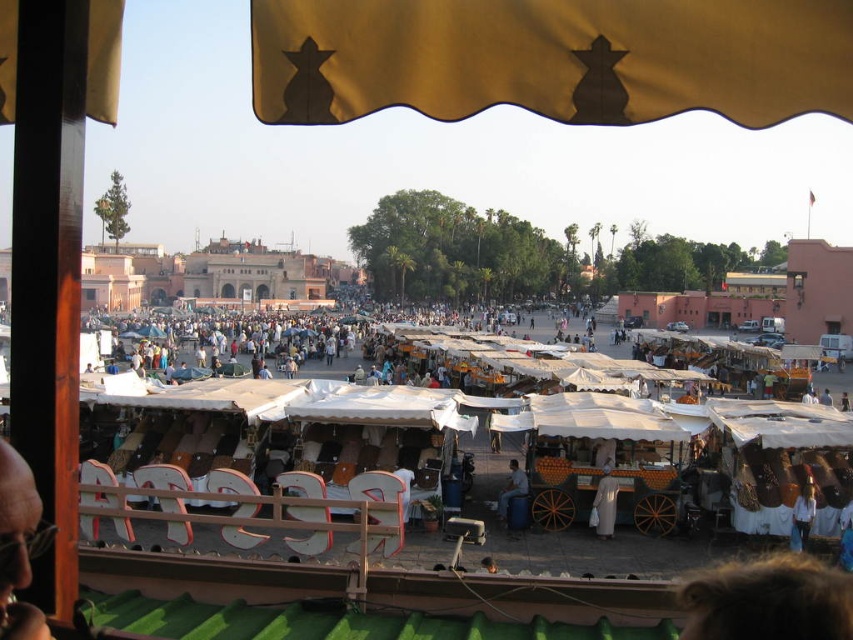
Between white cotton dress at center and light brown wooden cart at center, which one appears on the left side from the viewer's perspective?

light brown wooden cart at center is more to the left.

Between point (618, 490) and point (515, 465), which one is positioned in front?

Point (618, 490) is more forward.

Where is `white cotton dress at center`? white cotton dress at center is located at coordinates (604, 502).

Does point (798, 525) come in front of point (521, 493)?

Yes.

In the scene shown: Is white cotton dress at lower right smaller than light brown wooden cart at center?

Actually, white cotton dress at lower right might be larger than light brown wooden cart at center.

Who is more distant from viewer, (807,512) or (509,488)?

Positioned behind is point (509,488).

The image size is (853, 640). In order to click on white cotton dress at lower right in this screenshot , I will do `click(802, 516)`.

Who is higher up, white cotton dress at center or white cotton dress at lower right?

Positioned higher is white cotton dress at center.

Which of these two, white cotton dress at center or white cotton dress at lower right, stands shorter?

white cotton dress at lower right

Is point (610, 532) closer to camera compared to point (810, 515)?

That is False.

This screenshot has width=853, height=640. I want to click on white cotton dress at center, so click(604, 502).